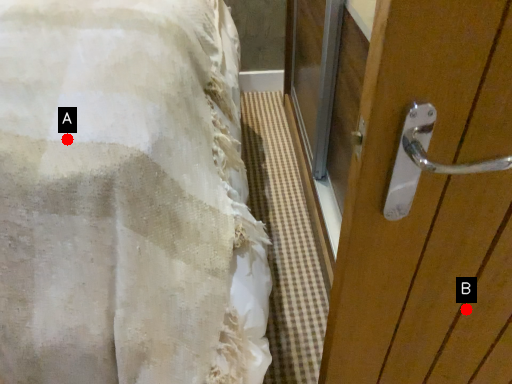
Question: Two points are circled on the image, labeled by A and B beside each circle. Which point is farther to the camera?

Choices:
 (A) A is further
 (B) B is further

Answer: (B)